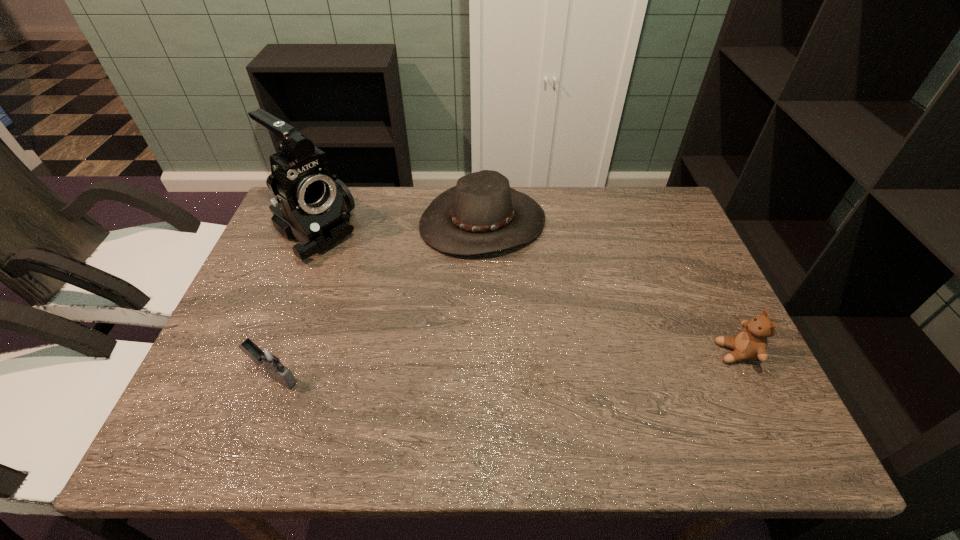
Locate an element on the screen. The height and width of the screenshot is (540, 960). vacant space on the desktop that is between the igniter and the rightmost object and is positioned on the lens mount of the camcorder is located at coordinates (492, 365).

At what (x,y) coordinates should I click in order to perform the action: click on vacant space on the desktop that is between the igniter and the rightmost object and is positioned on the front-facing side of the second object from right to left. Please return your answer as a coordinate pair (x, y). Looking at the image, I should click on (578, 361).